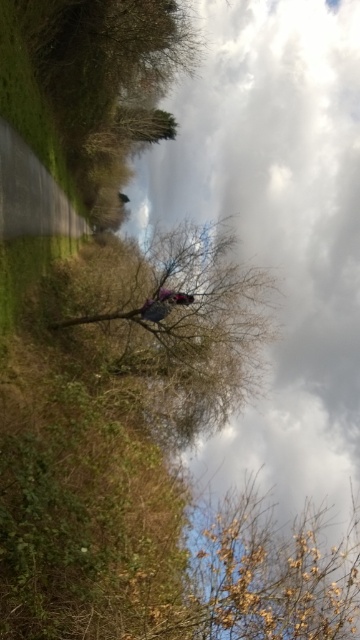
Does cloudy sky at upper center appear over brown textured tree at center?

Yes.

Who is positioned more to the left, cloudy sky at upper center or brown textured tree at center?

brown textured tree at center is more to the left.

What do you see at coordinates (277, 228) in the screenshot? I see `cloudy sky at upper center` at bounding box center [277, 228].

Where is `cloudy sky at upper center`? cloudy sky at upper center is located at coordinates (277, 228).